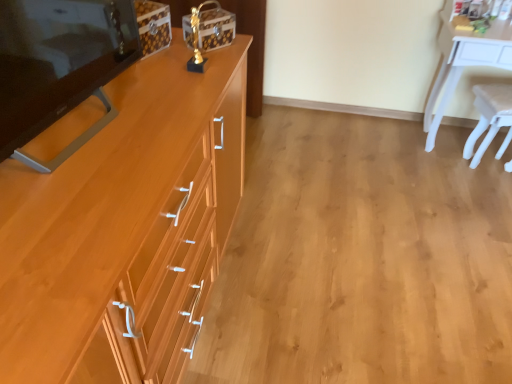
Find the location of a particular element. space that is in front of white glossy desk at upper right is located at coordinates (461, 195).